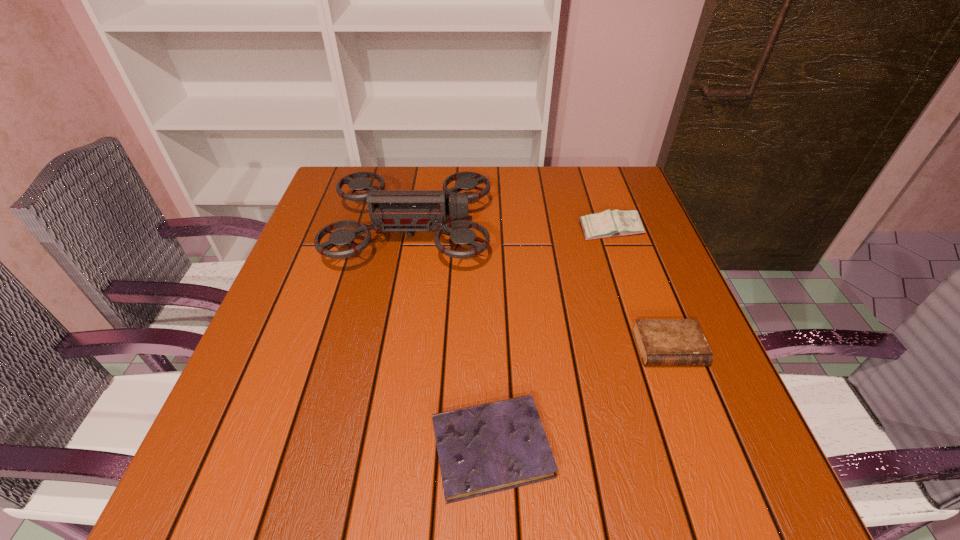
You are a GUI agent. You are given a task and a screenshot of the screen. Output one action in this format:
    pyautogui.click(x=<x>, y=<y>)
    Task: Click on the vacant space located on the back of the nearest object
    This screenshot has height=540, width=960.
    Given the screenshot: What is the action you would take?
    pyautogui.click(x=489, y=319)

Where is `object that is at the far edge`? This screenshot has width=960, height=540. object that is at the far edge is located at coordinates (394, 210).

This screenshot has height=540, width=960. What are the coordinates of `object positioned at the near edge` in the screenshot? It's located at (487, 448).

Where is `object at the left edge`? This screenshot has height=540, width=960. object at the left edge is located at coordinates (394, 210).

Where is `object that is positioned at the far left corner`? The height and width of the screenshot is (540, 960). object that is positioned at the far left corner is located at coordinates (394, 210).

At what (x,y) coordinates should I click in order to perform the action: click on vacant space at the far edge of the desktop. Please return your answer as a coordinate pair (x, y). Looking at the image, I should click on (555, 186).

You are a GUI agent. You are given a task and a screenshot of the screen. Output one action in this format:
    pyautogui.click(x=<x>, y=<y>)
    Task: Click on the vacant region at the left edge of the desktop
    This screenshot has width=960, height=540.
    Given the screenshot: What is the action you would take?
    pyautogui.click(x=327, y=341)

In order to click on free space at the right edge of the desktop in this screenshot , I will do `click(678, 309)`.

Find the location of `vacant region at the far left corner`. vacant region at the far left corner is located at coordinates (359, 169).

In the image, there is a desktop. Where is `vacant space at the near left corner`? The image size is (960, 540). vacant space at the near left corner is located at coordinates point(299,462).